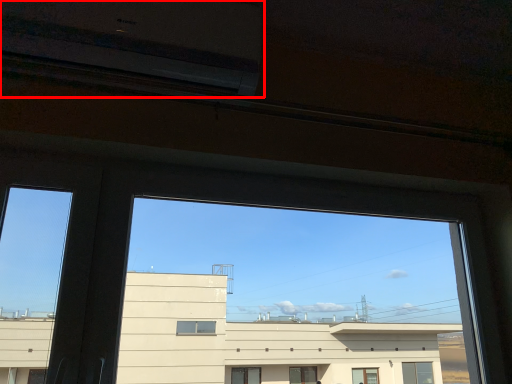
Question: From the image's perspective, what is the correct spatial relationship of air conditioning (annotated by the red box) in relation to train window?

Choices:
 (A) below
 (B) above

Answer: (B)